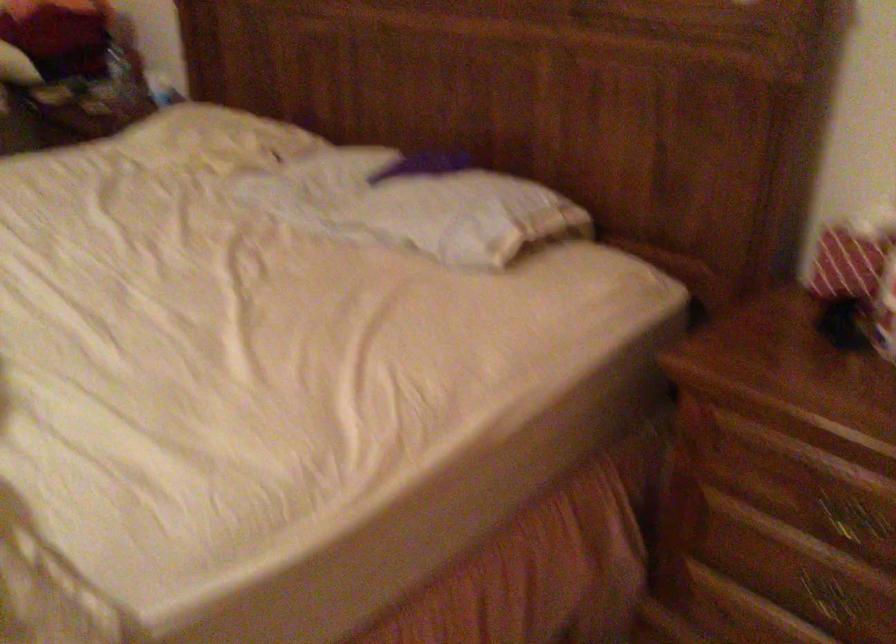
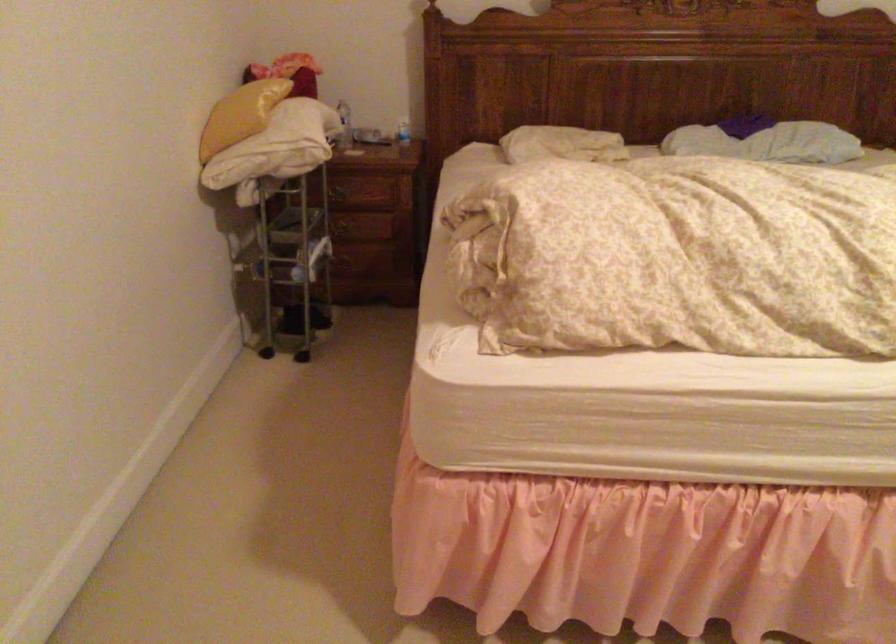
The point at (337, 214) is marked in the first image. Where is the corresponding point in the second image?

(767, 142)